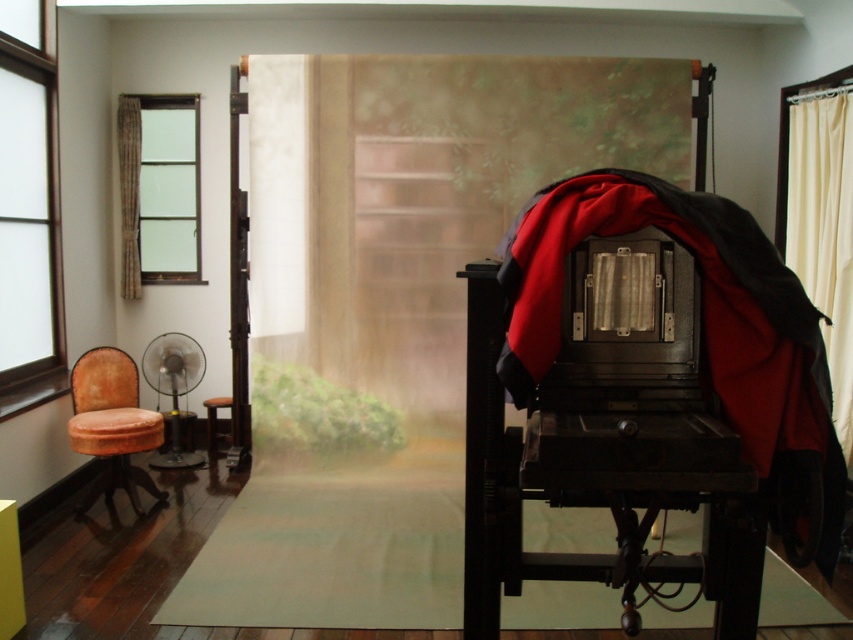
Question: Is red fabric curtain at center above satin glass window at left?

Choices:
 (A) no
 (B) yes

Answer: (B)

Question: Which object is closer to the camera taking this photo?

Choices:
 (A) floral fabric curtain at left
 (B) beige fabric curtain at right

Answer: (B)

Question: Is satin glass window at left smaller than floral fabric curtain at left?

Choices:
 (A) yes
 (B) no

Answer: (B)

Question: In this image, where is red fabric curtain at center located relative to satin glass window at left?

Choices:
 (A) left
 (B) right

Answer: (B)

Question: Which point is closer to the camera?

Choices:
 (A) floral fabric curtain at left
 (B) velvet orange stool at lower left
 (C) satin glass window at left

Answer: (C)

Question: Which point is closer to the camera?

Choices:
 (A) floral fabric curtain at left
 (B) beige fabric curtain at right
 (C) velvet orange armchair at left

Answer: (C)